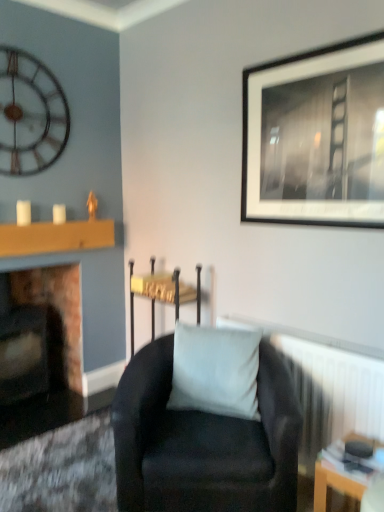
Image resolution: width=384 pixels, height=512 pixels. Find the location of `blank space above black matte picture frame at upper right (from a real-world perspective)`. blank space above black matte picture frame at upper right (from a real-world perspective) is located at coordinates (316, 46).